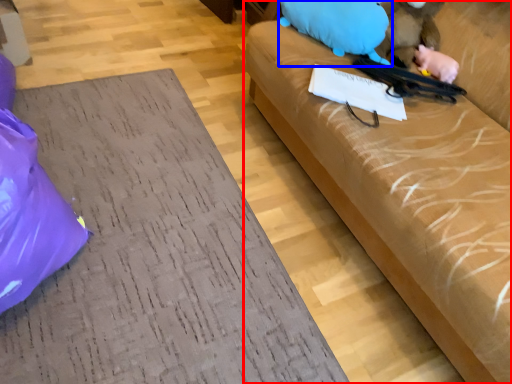
Question: Which point is further to the camera, studio couch (highlighted by a red box) or animal (highlighted by a blue box)?

Choices:
 (A) studio couch
 (B) animal

Answer: (B)